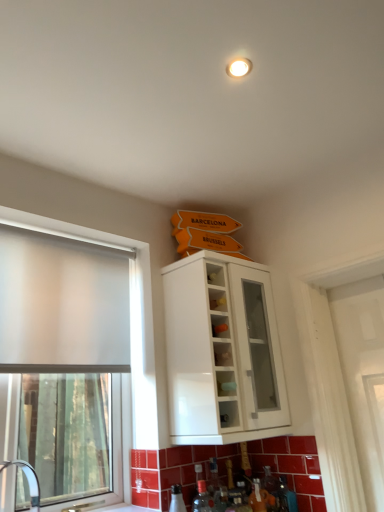
Question: From a real-world perspective, is frosted glass window at left physically below white glossy cabinet at upper center?

Choices:
 (A) no
 (B) yes

Answer: (B)

Question: Is frosted glass window at left behind white glossy cabinet at upper center?

Choices:
 (A) no
 (B) yes

Answer: (A)

Question: Is frosted glass window at left to the right of white glossy cabinet at upper center from the viewer's perspective?

Choices:
 (A) no
 (B) yes

Answer: (A)

Question: From the image's perspective, does frosted glass window at left appear higher than white glossy cabinet at upper center?

Choices:
 (A) yes
 (B) no

Answer: (B)

Question: From a real-world perspective, is frosted glass window at left on white glossy cabinet at upper center?

Choices:
 (A) no
 (B) yes

Answer: (A)

Question: From the image's perspective, is frosted glass window at left beneath white glossy cabinet at upper center?

Choices:
 (A) no
 (B) yes

Answer: (B)

Question: Is white glossy sink at lower left not within frosted glass window at left?

Choices:
 (A) no
 (B) yes

Answer: (B)

Question: Is white glossy sink at lower left not near frosted glass window at left?

Choices:
 (A) yes
 (B) no

Answer: (B)

Question: Can you confirm if white glossy sink at lower left is positioned to the left of frosted glass window at left?

Choices:
 (A) no
 (B) yes

Answer: (A)

Question: Is frosted glass window at left located within white glossy sink at lower left?

Choices:
 (A) no
 (B) yes

Answer: (A)

Question: Can you confirm if white glossy sink at lower left is thinner than frosted glass window at left?

Choices:
 (A) no
 (B) yes

Answer: (A)

Question: Considering the relative sizes of white glossy sink at lower left and frosted glass window at left in the image provided, is white glossy sink at lower left bigger than frosted glass window at left?

Choices:
 (A) yes
 (B) no

Answer: (B)

Question: Is white glossy cabinet at upper center closer to camera compared to frosted glass window at left?

Choices:
 (A) no
 (B) yes

Answer: (A)